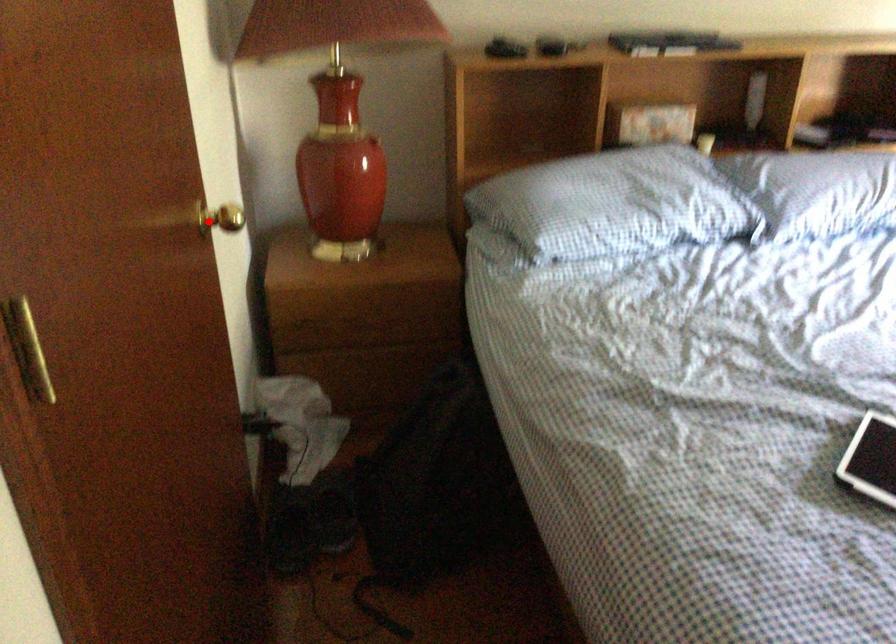
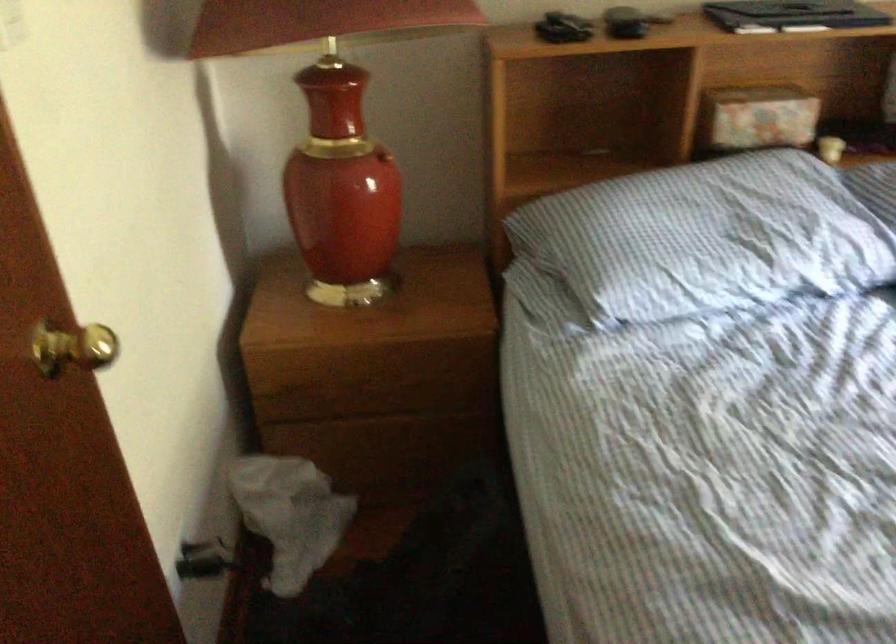
Question: A red point is marked in image1. In image2, is the corresponding 3D point closer to the camera or farther? Reply with the corresponding letter.

Choices:
 (A) The corresponding 3D point is closer.
 (B) The corresponding 3D point is farther.

Answer: (A)